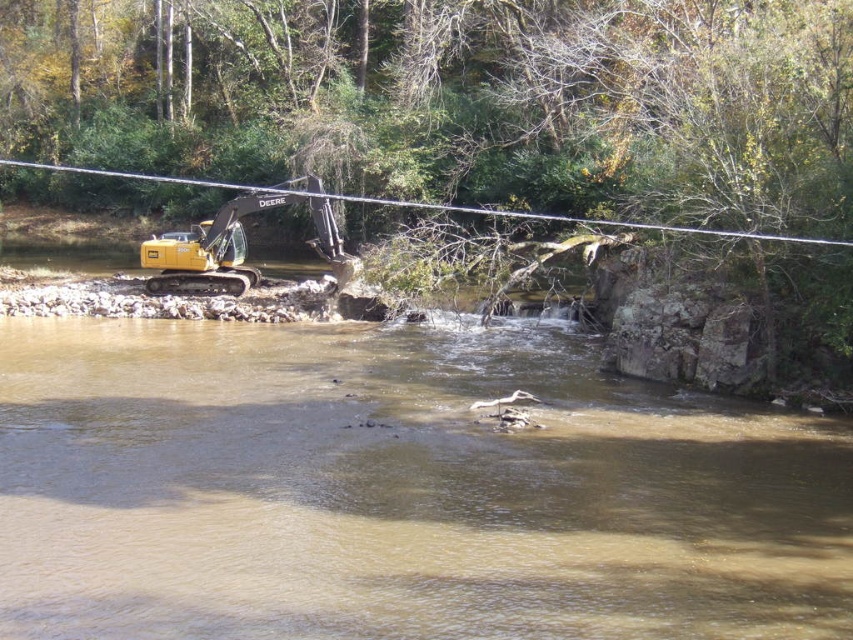
Is point (231, 250) less distant than point (590, 221)?

Yes, point (231, 250) is in front of point (590, 221).

Between point (202, 292) and point (759, 234), which one is positioned in front?

Point (759, 234)

You are a GUI agent. You are given a task and a screenshot of the screen. Output one action in this format:
    pyautogui.click(x=<x>, y=<y>)
    Task: Click on the yellow metallic excavator at upper left
    This screenshot has width=853, height=640.
    Given the screenshot: What is the action you would take?
    pyautogui.click(x=234, y=250)

Locate an element on the screen. yellow metallic excavator at upper left is located at coordinates (234, 250).

Is brown sedimentary water at left below smooth wire at upper center?

Yes, brown sedimentary water at left is below smooth wire at upper center.

Is point (59, 260) positioned behind point (302, 193)?

Yes, point (59, 260) is behind point (302, 193).

Where is `brown sedimentary water at left`? brown sedimentary water at left is located at coordinates (396, 492).

Is brown sedimentary water at left to the left of yellow metallic excavator at upper left from the viewer's perspective?

In fact, brown sedimentary water at left is to the right of yellow metallic excavator at upper left.

Does brown sedimentary water at left have a larger size compared to yellow metallic excavator at upper left?

No, brown sedimentary water at left is not bigger than yellow metallic excavator at upper left.

Who is more forward, (x=392, y=468) or (x=213, y=259)?

Point (x=392, y=468) is in front.

This screenshot has height=640, width=853. In order to click on brown sedimentary water at left in this screenshot , I will do `click(396, 492)`.